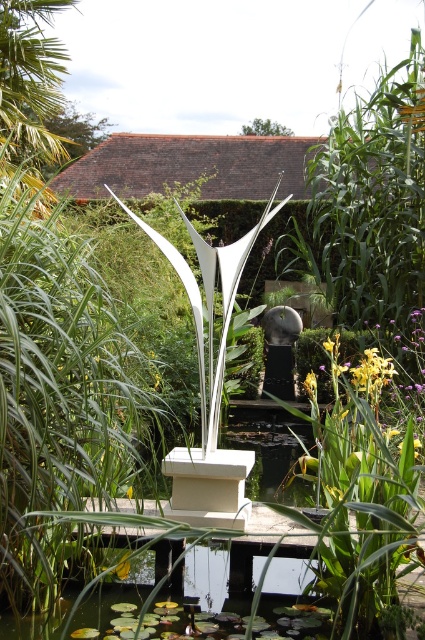
Which is in front, point (172, 257) or point (291, 365)?

Point (172, 257) is in front.

Which is above, white glossy sculpture at center or satin silver sculpture at center?

white glossy sculpture at center is above.

Measure the distance between point (203, 353) and camera.

A distance of 13.50 feet exists between point (203, 353) and camera.

Where is `white glossy sculpture at center`? The width and height of the screenshot is (425, 640). white glossy sculpture at center is located at coordinates (210, 308).